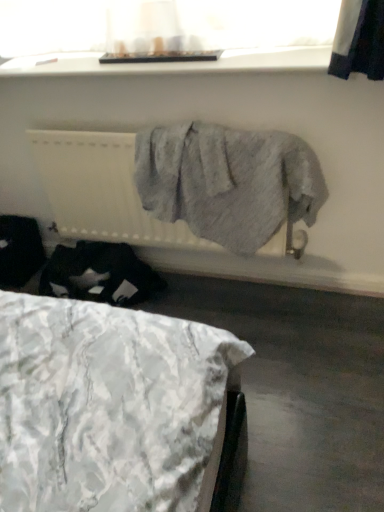
Identify the location of white textured radiator at center. Image resolution: width=384 pixels, height=512 pixels. (102, 190).

This screenshot has height=512, width=384. What do you see at coordinates (159, 30) in the screenshot?
I see `translucent fabric at upper center` at bounding box center [159, 30].

Image resolution: width=384 pixels, height=512 pixels. What do you see at coordinates (106, 405) in the screenshot? I see `white textured fabric at lower left` at bounding box center [106, 405].

At what (x,y) coordinates should I click in order to perform the action: click on white textured radiator at center. Please return your answer as a coordinate pair (x, y). The height and width of the screenshot is (512, 384). Looking at the image, I should click on (102, 190).

From the image's perspective, would you say white textured fabric at lower left is positioned over white textured radiator at center?

No.

Looking at this image, is white textured fabric at lower left positioned far away from white textured radiator at center?

white textured fabric at lower left is near white textured radiator at center, not far away.

From a real-world perspective, is white textured fabric at lower left positioned above or below white textured radiator at center?

white textured fabric at lower left is situated lower than white textured radiator at center in the real world.

Which is more to the left, white textured fabric at lower left or white textured radiator at center?

white textured fabric at lower left is more to the left.

Is translucent fabric at upper center further to the viewer compared to white textured fabric at lower left?

Yes, translucent fabric at upper center is behind white textured fabric at lower left.

Where is `bed directly beneath the translucent fabric at upper center (from a real-world perspective)`? This screenshot has height=512, width=384. bed directly beneath the translucent fabric at upper center (from a real-world perspective) is located at coordinates (106, 405).

Which of these two, translucent fabric at upper center or white textured fabric at lower left, is smaller?

Smaller between the two is translucent fabric at upper center.

From a real-world perspective, between translucent fabric at upper center and white textured fabric at lower left, who is vertically higher?

translucent fabric at upper center is physically above.

Is white textured radiator at center placed right next to translucent fabric at upper center?

white textured radiator at center is not next to translucent fabric at upper center, and they're not touching.

Where is `radiator behind the translucent fabric at upper center`? radiator behind the translucent fabric at upper center is located at coordinates (102, 190).

What's the angular difference between white textured radiator at center and translucent fabric at upper center's facing directions?

The facing directions of white textured radiator at center and translucent fabric at upper center are 0.063 degrees apart.

Is white textured radiator at center completely or partially outside of translucent fabric at upper center?

white textured radiator at center is positioned outside translucent fabric at upper center.

From a real-world perspective, is translucent fabric at upper center physically located above or below white smooth window sill at upper center?

In terms of real-world spatial position, translucent fabric at upper center is above white smooth window sill at upper center.

Is translucent fabric at upper center inside or outside of white smooth window sill at upper center?

translucent fabric at upper center is spatially situated outside white smooth window sill at upper center.

Measure the distance from translucent fabric at upper center to white smooth window sill at upper center.

The distance of translucent fabric at upper center from white smooth window sill at upper center is 9.92 centimeters.

The height and width of the screenshot is (512, 384). Find the location of `window sill above the white textured fabric at lower left (from a real-world perspective)`. window sill above the white textured fabric at lower left (from a real-world perspective) is located at coordinates (175, 63).

Who is taller, white smooth window sill at upper center or white textured fabric at lower left?

With more height is white smooth window sill at upper center.

Is white smooth window sill at upper center aimed at white textured fabric at lower left?

No, white smooth window sill at upper center is not turned towards white textured fabric at lower left.

Would you say white smooth window sill at upper center is outside white textured fabric at lower left?

Yes, white smooth window sill at upper center is outside of white textured fabric at lower left.

This screenshot has height=512, width=384. What are the coordinates of `window screen located above the white textured radiator at center (from a real-world perspective)` in the screenshot? It's located at (159, 30).

From a real-world perspective, which object stands above the other?

From a 3D spatial view, translucent fabric at upper center is above.

Between translucent fabric at upper center and white textured radiator at center, which one is positioned behind?

white textured radiator at center is behind.

From the picture: From the image's perspective, is translucent fabric at upper center positioned above or below white textured radiator at center?

Clearly, from the image's perspective, translucent fabric at upper center is above white textured radiator at center.

From the image's perspective, is white textured fabric at lower left on top of translucent fabric at upper center?

No, from the image's perspective, white textured fabric at lower left is not above translucent fabric at upper center.

Which is correct: white textured fabric at lower left is inside translucent fabric at upper center, or outside of it?

white textured fabric at lower left exists outside the volume of translucent fabric at upper center.

Based on the photo, considering the sizes of objects white textured fabric at lower left and translucent fabric at upper center in the image provided, who is taller, white textured fabric at lower left or translucent fabric at upper center?

translucent fabric at upper center is taller.

Is white textured fabric at lower left facing away from translucent fabric at upper center?

white textured fabric at lower left does not have its back to translucent fabric at upper center.

There is a white textured fabric at lower left. Identify the location of radiator above it (from a real-world perspective). (102, 190).

Where is `window screen located behind the white textured fabric at lower left`? This screenshot has height=512, width=384. window screen located behind the white textured fabric at lower left is located at coordinates (159, 30).

Which object lies nearer to the anchor point white textured fabric at lower left, white smooth window sill at upper center or white textured radiator at center?

white textured radiator at center is closer to white textured fabric at lower left.

When comparing their distances from white textured fabric at lower left, does white textured radiator at center or white smooth window sill at upper center seem closer?

Based on the image, white textured radiator at center appears to be nearer to white textured fabric at lower left.

From the image, which object appears to be nearer to white textured fabric at lower left, white textured radiator at center or translucent fabric at upper center?

Among the two, white textured radiator at center is located nearer to white textured fabric at lower left.

Looking at the image, which one is located closer to white textured radiator at center, white textured fabric at lower left or translucent fabric at upper center?

The object closer to white textured radiator at center is translucent fabric at upper center.

Estimate the real-world distances between objects in this image. Which object is further from white smooth window sill at upper center, translucent fabric at upper center or white textured fabric at lower left?

white textured fabric at lower left lies further to white smooth window sill at upper center than the other object.

From the image, which object appears to be nearer to white textured fabric at lower left, translucent fabric at upper center or white textured radiator at center?

white textured radiator at center lies closer to white textured fabric at lower left than the other object.

Considering their positions, is white textured fabric at lower left positioned further to white textured radiator at center than white smooth window sill at upper center?

The object further to white textured radiator at center is white textured fabric at lower left.

Looking at the image, which one is located further to translucent fabric at upper center, white textured radiator at center or white smooth window sill at upper center?

The object further to translucent fabric at upper center is white textured radiator at center.

Where is `radiator between white smooth window sill at upper center and white textured fabric at lower left from top to bottom`? radiator between white smooth window sill at upper center and white textured fabric at lower left from top to bottom is located at coordinates (102, 190).

Locate an element on the screen. Image resolution: width=384 pixels, height=512 pixels. radiator between translucent fabric at upper center and white textured fabric at lower left in the vertical direction is located at coordinates (102, 190).

The image size is (384, 512). Find the location of `window sill between translucent fabric at upper center and white textured fabric at lower left in the up-down direction`. window sill between translucent fabric at upper center and white textured fabric at lower left in the up-down direction is located at coordinates (175, 63).

Find the location of a particular element. window sill between translucent fabric at upper center and white textured radiator at center vertically is located at coordinates (175, 63).